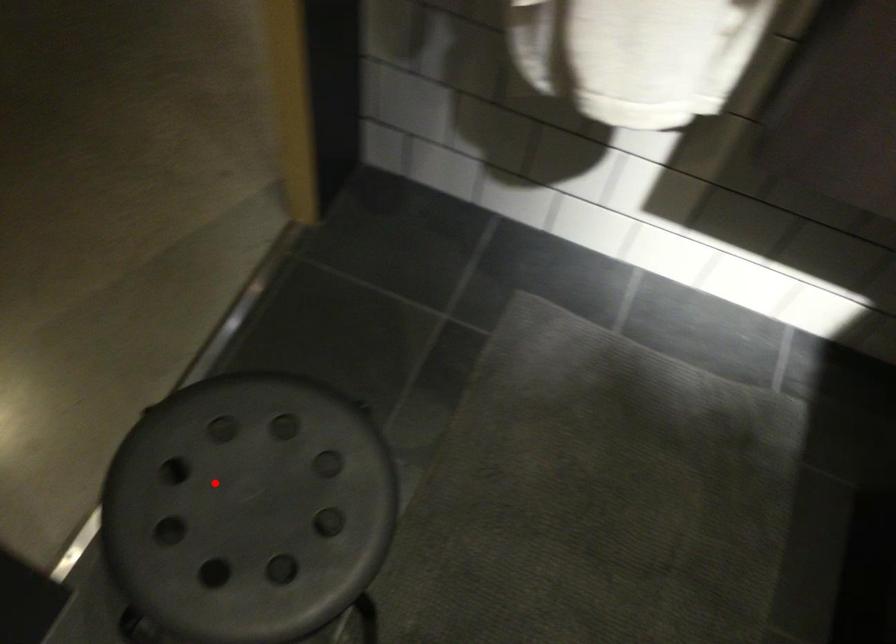
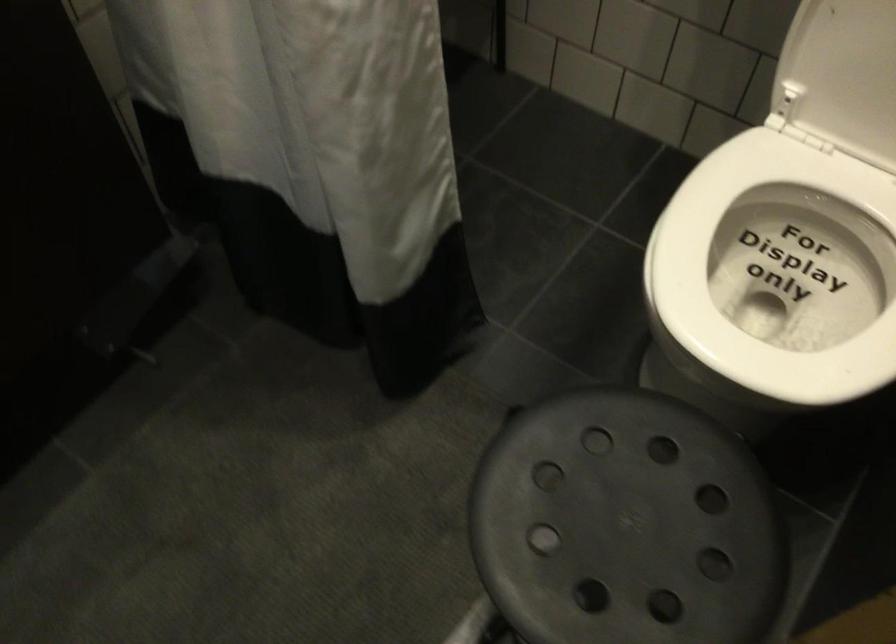
Question: I am providing you with two images of the same scene from different viewpoints. A red point is shown in image1. For the corresponding object point in image2, is it positioned nearer or farther from the camera?

Choices:
 (A) Nearer
 (B) Farther

Answer: (A)